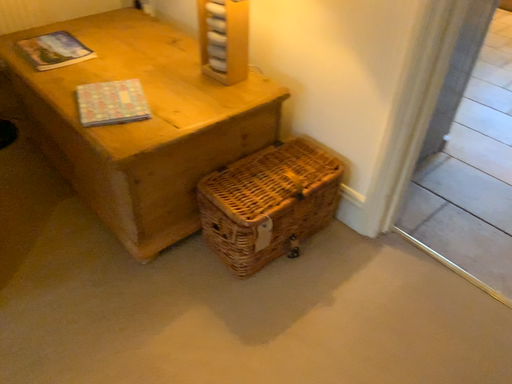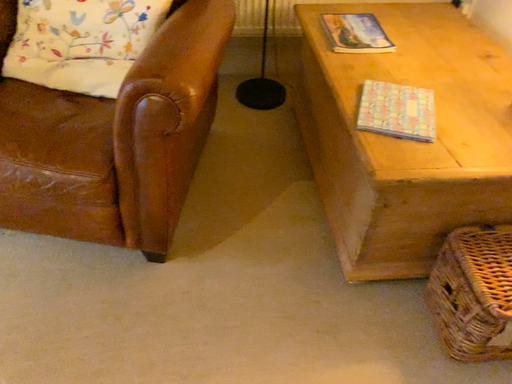
Question: How did the camera likely rotate when shooting the video?

Choices:
 (A) rotated right
 (B) rotated left

Answer: (B)